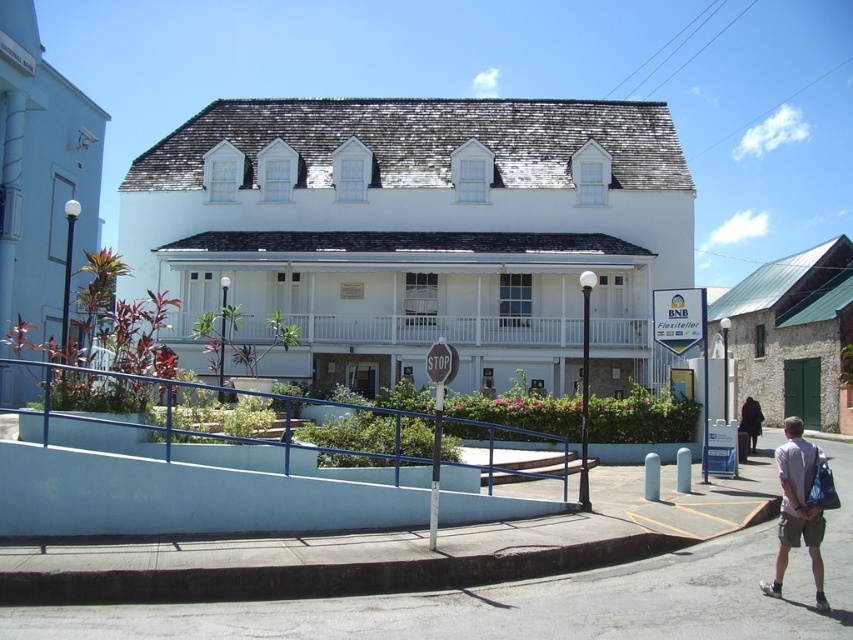
Between gray fabric backpack at lower right and dark brown leather jacket at lower right, which one has more height?

gray fabric backpack at lower right is taller.

Who is higher up, gray fabric backpack at lower right or dark brown leather jacket at lower right?

dark brown leather jacket at lower right

Which is behind, point (795, 536) or point (753, 404)?

Positioned behind is point (753, 404).

Find the location of a particular element. Image resolution: width=853 pixels, height=640 pixels. gray fabric backpack at lower right is located at coordinates [798, 508].

Looking at this image, can you confirm if blue metal railing at center is positioned to the left of dark brown leather jacket at lower right?

Correct, you'll find blue metal railing at center to the left of dark brown leather jacket at lower right.

Does point (105, 436) come closer to viewer compared to point (756, 404)?

Yes, it is in front of point (756, 404).

In order to click on blue metal railing at center in this screenshot , I will do `click(161, 444)`.

Which of these two, blue metal railing at center or gray fabric backpack at lower right, stands taller?

Standing taller between the two is gray fabric backpack at lower right.

Looking at this image, between blue metal railing at center and gray fabric backpack at lower right, which one has less height?

Standing shorter between the two is blue metal railing at center.

Between point (85, 448) and point (810, 538), which one is positioned in front?

Point (810, 538) is in front.

Locate an element on the screen. The width and height of the screenshot is (853, 640). blue metal railing at center is located at coordinates [x=161, y=444].